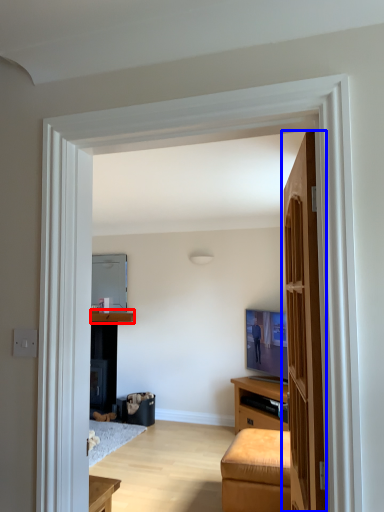
Question: Which object appears farthest to the camera in this image, cabinetry (highlighted by a red box) or door (highlighted by a blue box)?

Choices:
 (A) cabinetry
 (B) door

Answer: (A)